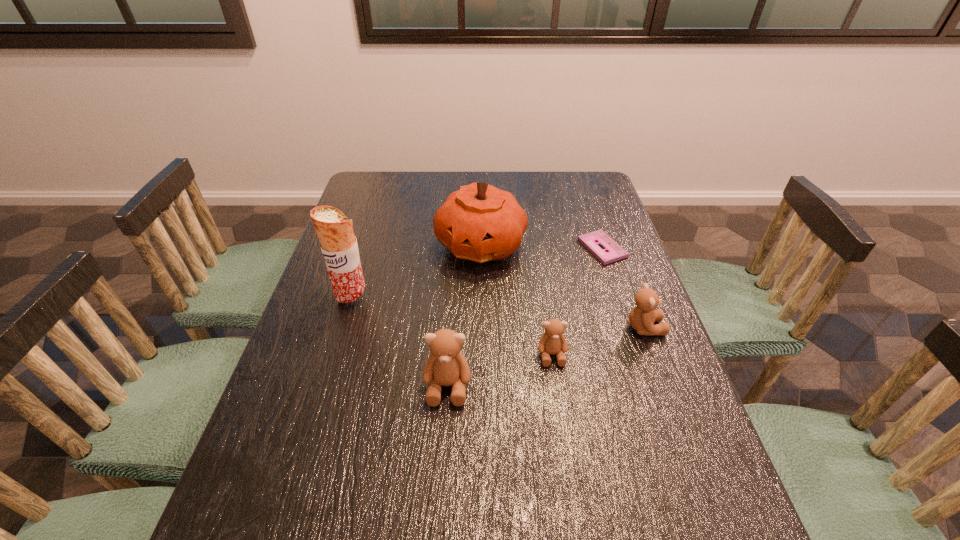
At what (x,y) coordinates should I click in order to perform the action: click on empty location between the shortest object and the tallest teddy bear. Please return your answer as a coordinate pair (x, y). Image resolution: width=960 pixels, height=540 pixels. Looking at the image, I should click on (525, 317).

In order to click on vacant space that is in between the burrito and the fifth shortest object in this screenshot , I will do pyautogui.click(x=417, y=271).

In order to click on free spot between the farthest teddy bear and the shortest object in this screenshot , I will do `click(623, 288)`.

You are a GUI agent. You are given a task and a screenshot of the screen. Output one action in this format:
    pyautogui.click(x=<x>, y=<y>)
    Task: Click on the object that is the third closest to the videotape
    
    Given the screenshot: What is the action you would take?
    pyautogui.click(x=552, y=342)

Select which object is the third closest to the fifth tallest object. Please provide its 2D coordinates. Your answer should be formatted as a tuple, i.e. [(x, y)], where the tuple contains the x and y coordinates of a point satisfying the conditions above.

[(480, 223)]

Where is `teddy bear that stands as the third closest to the fifth shortest object`? The width and height of the screenshot is (960, 540). teddy bear that stands as the third closest to the fifth shortest object is located at coordinates (446, 365).

Find the location of `teddy bear identified as the second closest to the tallest teddy bear`. teddy bear identified as the second closest to the tallest teddy bear is located at coordinates (642, 317).

Locate an element on the screen. The image size is (960, 540). free spot that satisfies the following two spatial constraints: 1. on the front-facing side of the farthest teddy bear; 2. on the front-facing side of the second teddy bear from right to left is located at coordinates (654, 355).

Locate an element on the screen. free space that satisfies the following two spatial constraints: 1. on the front-facing side of the fourth tallest object; 2. on the front-facing side of the shortest teddy bear is located at coordinates (654, 355).

At what (x,y) coordinates should I click in order to perform the action: click on blank space that satisfies the following two spatial constraints: 1. on the front-facing side of the rightmost teddy bear; 2. on the front-facing side of the leftmost teddy bear. Please return your answer as a coordinate pair (x, y). The width and height of the screenshot is (960, 540). Looking at the image, I should click on (665, 386).